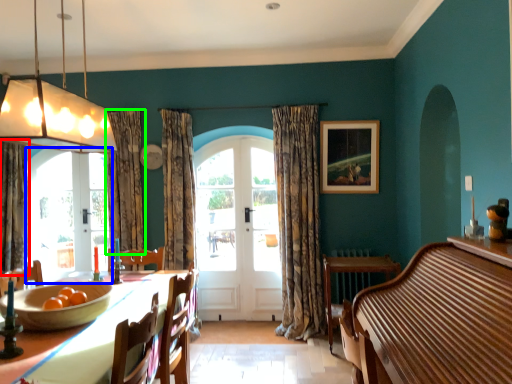
Question: Which object is positioned farthest from curtain (highlighted by a red box)? Select from bay window (highlighted by a blue box) and curtain (highlighted by a green box).

Choices:
 (A) bay window
 (B) curtain

Answer: (B)